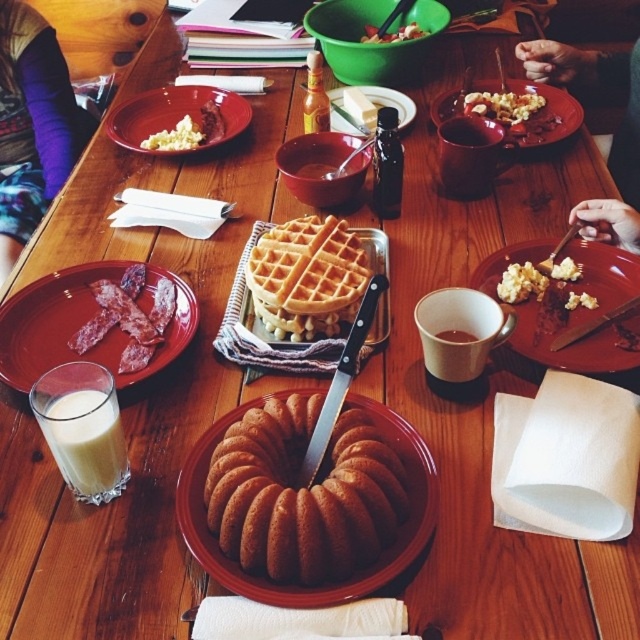
Question: Estimate the real-world distances between objects in this image. Which object is closer to the purple fabric at upper left?

Choices:
 (A) white opaque glass at lower left
 (B) matte ceramic plate with bacon at left
 (C) matte brown plate at center
 (D) crumbly yellow cake at upper right

Answer: (B)

Question: Does golden brown waffle at center appear over crumbly yellow cake at upper right?

Choices:
 (A) no
 (B) yes

Answer: (A)

Question: Which is nearer to the matte ceramic plate at upper right?

Choices:
 (A) white crumbly food at upper left
 (B) brown glazed bundt cake at center
 (C) matte ceramic plate at upper left
 (D) matte brown plate at center

Answer: (D)

Question: Does white opaque glass at lower left have a smaller size compared to white crumbly food at upper left?

Choices:
 (A) no
 (B) yes

Answer: (B)

Question: Which object appears farthest from the camera in this image?

Choices:
 (A) white opaque glass at lower left
 (B) matte ceramic bowl at center
 (C) crumbly yellow cake at upper right

Answer: (B)

Question: Does golden brown waffle at center have a smaller size compared to smooth plastic bowl at center?

Choices:
 (A) yes
 (B) no

Answer: (B)